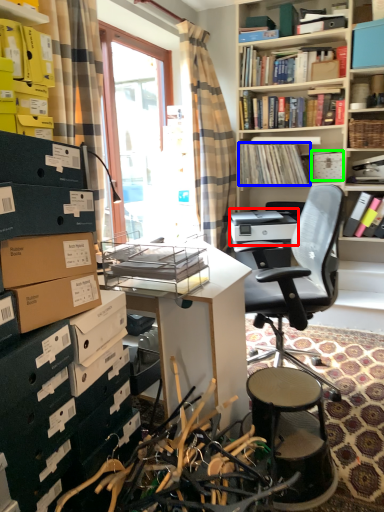
Question: Which object is the farthest from printer (highlighted by a red box)? Choose among these: book (highlighted by a blue box) or storage box (highlighted by a green box).

Choices:
 (A) book
 (B) storage box

Answer: (B)